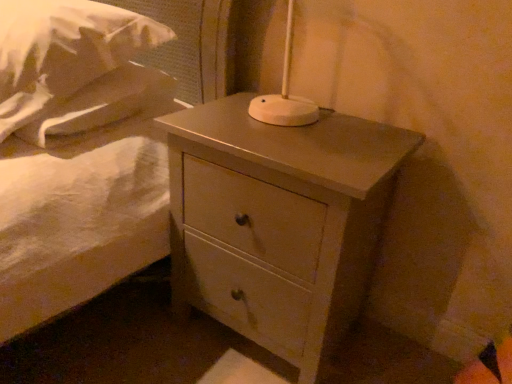
Question: In the image, is white matte nightstand at center positioned in front of or behind white soft pillow at upper left?

Choices:
 (A) front
 (B) behind

Answer: (B)

Question: Is white matte nightstand at center wider or thinner than white soft pillow at upper left?

Choices:
 (A) wide
 (B) thin

Answer: (B)

Question: From the image's perspective, relative to white soft pillow at upper left, is white matte nightstand at center above or below?

Choices:
 (A) above
 (B) below

Answer: (B)

Question: Looking at their shapes, would you say white soft pillow at upper left is wider or thinner than white matte nightstand at center?

Choices:
 (A) thin
 (B) wide

Answer: (B)

Question: Considering the positions of white soft pillow at upper left and white matte nightstand at center in the image, is white soft pillow at upper left taller or shorter than white matte nightstand at center?

Choices:
 (A) tall
 (B) short

Answer: (B)

Question: Is white soft pillow at upper left inside or outside of white matte nightstand at center?

Choices:
 (A) inside
 (B) outside

Answer: (B)

Question: From a real-world perspective, is white soft pillow at upper left positioned above or below white matte nightstand at center?

Choices:
 (A) below
 (B) above

Answer: (B)